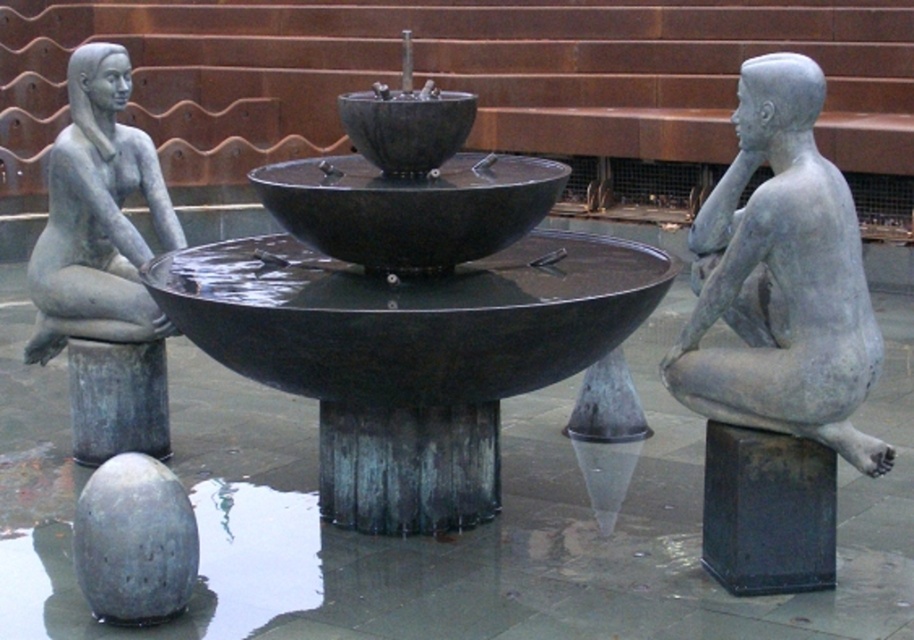
Which is behind, point (546, 180) or point (752, 104)?

The point (546, 180) is behind.

The height and width of the screenshot is (640, 914). What do you see at coordinates (410, 305) in the screenshot? I see `matte black fountain at center` at bounding box center [410, 305].

The height and width of the screenshot is (640, 914). What are the coordinates of `matte black fountain at center` in the screenshot? It's located at (410, 305).

Who is positioned more to the right, matte gray statue at right or matte gray statue at left?

matte gray statue at right

Measure the distance between matte gray statue at right and camera.

A distance of 7.64 meters exists between matte gray statue at right and camera.

Is point (753, 129) more distant than point (131, 147)?

That is False.

This screenshot has width=914, height=640. I want to click on matte gray statue at right, so pyautogui.click(x=781, y=280).

Consider the image. Can you confirm if matte black fountain at center is smaller than black matte pillar at lower right?

No.

Between matte black fountain at center and black matte pillar at lower right, which one appears on the left side from the viewer's perspective?

Positioned to the left is matte black fountain at center.

The height and width of the screenshot is (640, 914). What are the coordinates of `matte black fountain at center` in the screenshot? It's located at (410, 305).